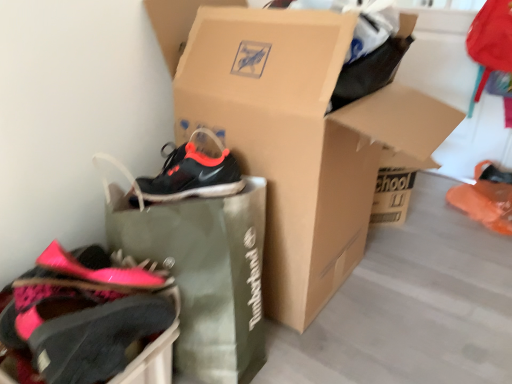
Question: Does pink fabric shoe at lower left, which ranks as the first footwear in left-to-right order, have a larger size compared to cardboard shoebox at center?

Choices:
 (A) yes
 (B) no

Answer: (B)

Question: Can you confirm if pink fabric shoe at lower left, placed as the 2th footwear when sorted from right to left, is smaller than cardboard shoebox at center?

Choices:
 (A) yes
 (B) no

Answer: (A)

Question: Would you say cardboard shoebox at center is part of pink fabric shoe at lower left, the 2th footwear viewed from the back,'s contents?

Choices:
 (A) no
 (B) yes

Answer: (A)

Question: Is pink fabric shoe at lower left, the 2th footwear viewed from the back, at the right side of cardboard shoebox at center?

Choices:
 (A) no
 (B) yes

Answer: (A)

Question: Is pink fabric shoe at lower left, the 2th footwear viewed from the back, placed right next to cardboard shoebox at center?

Choices:
 (A) yes
 (B) no

Answer: (B)

Question: Does point (160, 9) appear closer or farther from the camera than point (178, 200)?

Choices:
 (A) farther
 (B) closer

Answer: (A)

Question: Is cardboard shoebox at center spatially inside green fabric shopping bag at center, or outside of it?

Choices:
 (A) outside
 (B) inside

Answer: (A)

Question: In terms of height, does cardboard shoebox at center look taller or shorter compared to green fabric shopping bag at center?

Choices:
 (A) short
 (B) tall

Answer: (B)

Question: From a real-world perspective, is cardboard shoebox at center positioned above or below green fabric shopping bag at center?

Choices:
 (A) below
 (B) above

Answer: (B)

Question: Visually, is green fabric shopping bag at center positioned to the left or to the right of orange matte shoe at lower right, which is the 1th footwear from back to front?

Choices:
 (A) left
 (B) right

Answer: (A)

Question: From a real-world perspective, is green fabric shopping bag at center above or below orange matte shoe at lower right, positioned as the 2th footwear in front-to-back order?

Choices:
 (A) below
 (B) above

Answer: (B)

Question: From their relative heights in the image, would you say green fabric shopping bag at center is taller or shorter than orange matte shoe at lower right, positioned as the 2th footwear in front-to-back order?

Choices:
 (A) short
 (B) tall

Answer: (B)

Question: Considering the positions of green fabric shopping bag at center and orange matte shoe at lower right, which is the 1th footwear from back to front, in the image, is green fabric shopping bag at center bigger or smaller than orange matte shoe at lower right, which is the 1th footwear from back to front,?

Choices:
 (A) small
 (B) big

Answer: (B)

Question: Considering the positions of cardboard shoebox at center and pink fabric shoe at lower left, the 2th footwear viewed from the back, in the image, is cardboard shoebox at center taller or shorter than pink fabric shoe at lower left, the 2th footwear viewed from the back,?

Choices:
 (A) tall
 (B) short

Answer: (A)

Question: Looking at their shapes, would you say cardboard shoebox at center is wider or thinner than pink fabric shoe at lower left, the 2th footwear viewed from the back?

Choices:
 (A) thin
 (B) wide

Answer: (B)